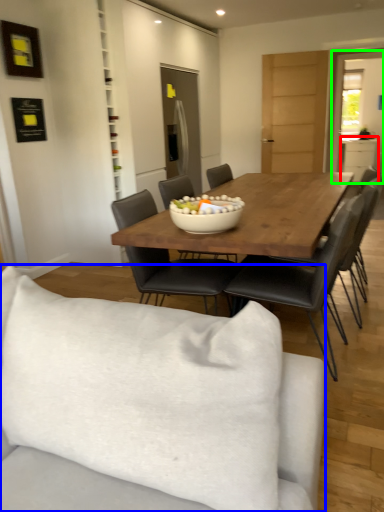
Question: Which object is positioned farthest from cabinetry (highlighted by a red box)? Select from studio couch (highlighted by a blue box) and glass door (highlighted by a green box).

Choices:
 (A) studio couch
 (B) glass door

Answer: (A)